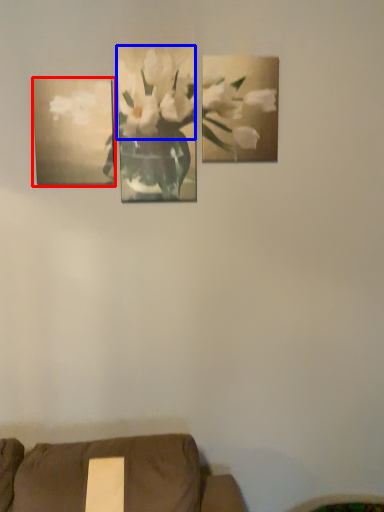
Question: Which object is closer to the camera taking this photo, picture frame (highlighted by a red box) or flower (highlighted by a blue box)?

Choices:
 (A) picture frame
 (B) flower

Answer: (A)